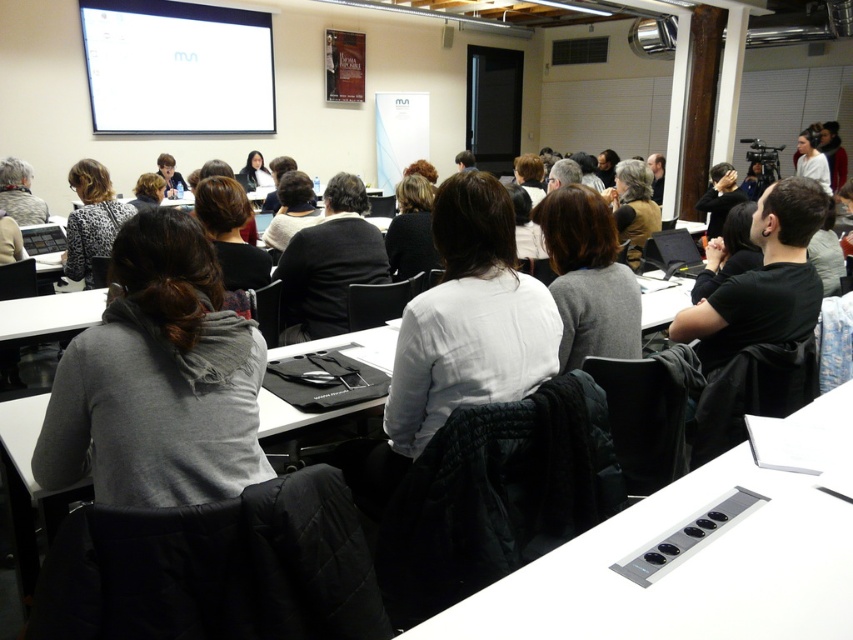
You are organizing a small event and need to place a 4 feet wide table between the gray matte sweater at center and the dark gray suit at center. Can the table fit between them?

The gray matte sweater at center and dark gray suit at center are 3.97 feet apart from each other, so a 4 feet wide table cannot fit between them as the distance is slightly less than the table width.